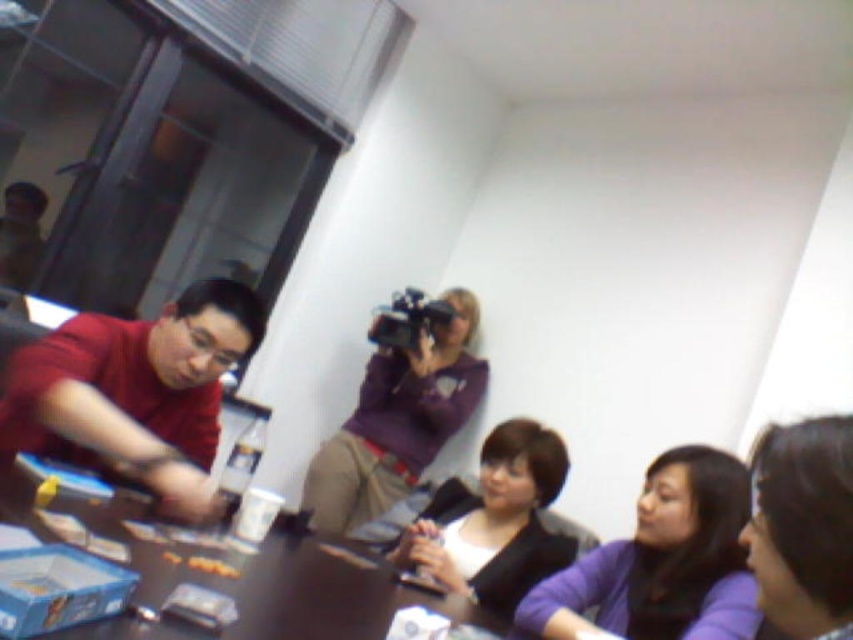
Can you confirm if purple matte shirt at lower right is taller than smooth purple shirt at lower right?

Indeed, purple matte shirt at lower right has a greater height compared to smooth purple shirt at lower right.

Does purple matte shirt at lower right appear on the right side of smooth purple shirt at lower right?

Indeed, purple matte shirt at lower right is positioned on the right side of smooth purple shirt at lower right.

The image size is (853, 640). What do you see at coordinates (663, 561) in the screenshot?
I see `purple matte shirt at lower right` at bounding box center [663, 561].

Find the location of a particular element. Image resolution: width=853 pixels, height=640 pixels. purple matte shirt at lower right is located at coordinates (663, 561).

Who is more distant from viewer, (314, 579) or (550, 572)?

Positioned behind is point (550, 572).

Can you confirm if dark brown wooden table at center is positioned above matte black jacket at center?

Indeed, dark brown wooden table at center is positioned over matte black jacket at center.

Which is in front, point (165, 586) or point (479, 602)?

Point (165, 586) is more forward.

The image size is (853, 640). What are the coordinates of `dark brown wooden table at center` in the screenshot? It's located at (235, 566).

Can you confirm if dark brown wooden table at center is wider than purple matte camera at upper center?

Correct, the width of dark brown wooden table at center exceeds that of purple matte camera at upper center.

Which of these two, dark brown wooden table at center or purple matte camera at upper center, stands shorter?

With less height is dark brown wooden table at center.

In order to click on dark brown wooden table at center in this screenshot , I will do `click(235, 566)`.